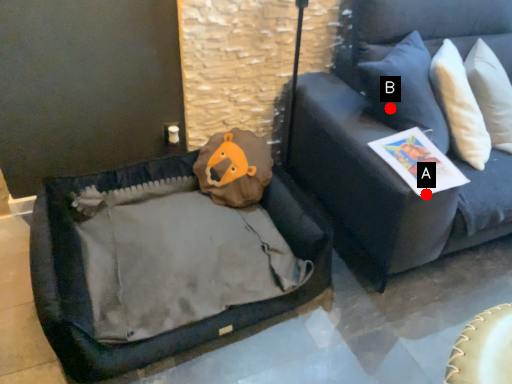
Question: Two points are circled on the image, labeled by A and B beside each circle. Among these points, which one is farthest from the camera?

Choices:
 (A) A is further
 (B) B is further

Answer: (B)